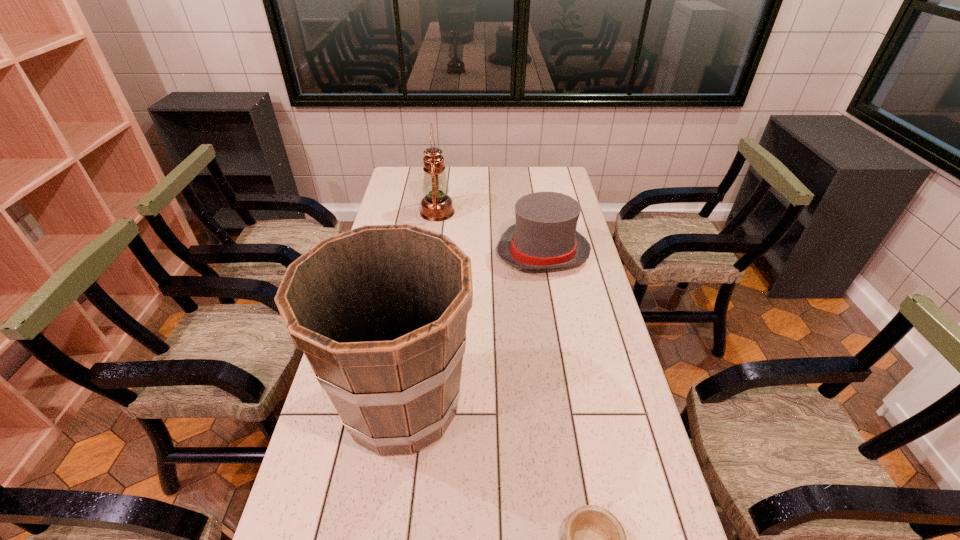
Image resolution: width=960 pixels, height=540 pixels. Identify the location of the third farthest object. (380, 312).

Where is `the farthest object`? The image size is (960, 540). the farthest object is located at coordinates pos(436,206).

This screenshot has height=540, width=960. In order to click on the third shortest object in this screenshot , I will do `click(436, 206)`.

At what (x,y) coordinates should I click in order to perform the action: click on the second farthest object. Please return your answer as a coordinate pair (x, y). This screenshot has height=540, width=960. Looking at the image, I should click on (544, 237).

I want to click on dress hat, so click(544, 237).

You are a GUI agent. You are given a task and a screenshot of the screen. Output one action in this format:
    pyautogui.click(x=<x>, y=<y>)
    Task: Click on the vacant region located on the right of the third farthest object
    
    Given the screenshot: What is the action you would take?
    pyautogui.click(x=524, y=404)

You are a GUI agent. You are given a task and a screenshot of the screen. Output one action in this format:
    pyautogui.click(x=<x>, y=<y>)
    Task: Click on the free space located on the right of the oil lamp
    The height and width of the screenshot is (540, 960).
    Given the screenshot: What is the action you would take?
    pyautogui.click(x=505, y=212)

This screenshot has width=960, height=540. Identify the location of free space located on the front of the dress hat. (554, 311).

At what (x,y) coordinates should I click in order to perform the action: click on bucket at the left edge. Please return your answer as a coordinate pair (x, y). Looking at the image, I should click on (380, 312).

Identify the location of oil lamp at the left edge. The image size is (960, 540). (436, 206).